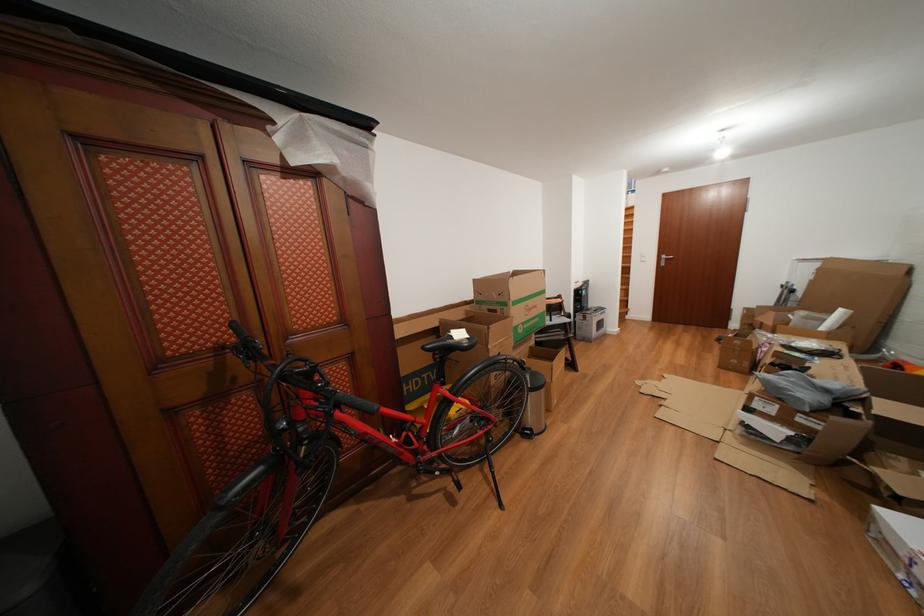
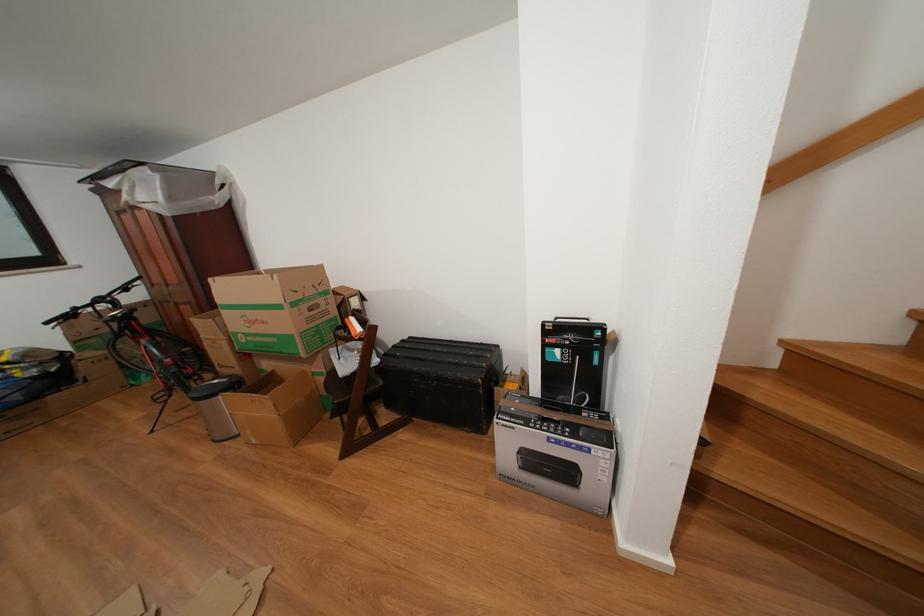
Where in the second image is the point corresponding to point 543,312 from the first image?

(272, 328)